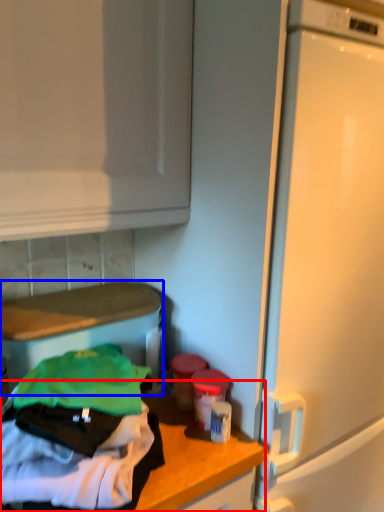
Question: Among these objects, which one is nearest to the camera, countertop (highlighted by a red box) or appliance (highlighted by a blue box)?

Choices:
 (A) countertop
 (B) appliance

Answer: (A)